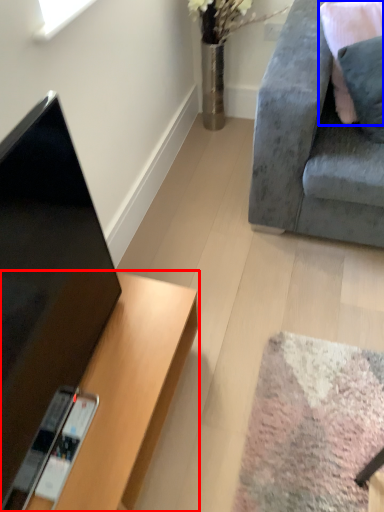
Question: Which of the following is the closest to the observer, desk (highlighted by a red box) or pillow (highlighted by a blue box)?

Choices:
 (A) desk
 (B) pillow

Answer: (A)